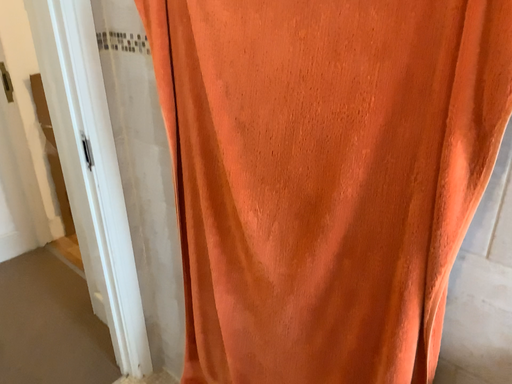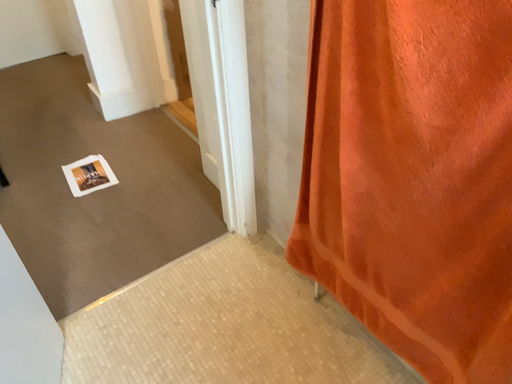
Question: Which way did the camera rotate in the video?

Choices:
 (A) rotated left
 (B) rotated right

Answer: (A)